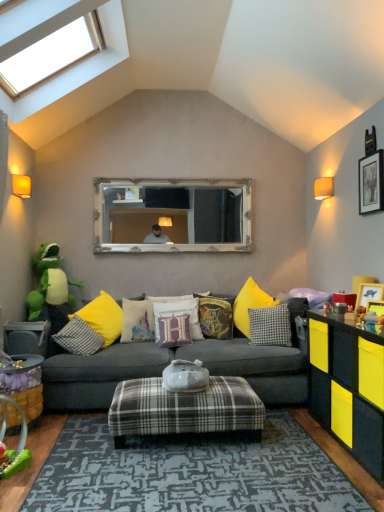
Question: Is velvet harry potter-themed pillow at center, acting as the sixth pillow starting from the left, touching wooden textured basket at lower left, the first table from the bottom?

Choices:
 (A) no
 (B) yes

Answer: (A)

Question: Can you confirm if velvet harry potter-themed pillow at center, which appears as the 2th pillow when viewed from the right, is thinner than wooden textured basket at lower left, marked as the 2th table in a top-to-bottom arrangement?

Choices:
 (A) yes
 (B) no

Answer: (A)

Question: Can you confirm if velvet harry potter-themed pillow at center, acting as the sixth pillow starting from the left, is shorter than wooden textured basket at lower left, marked as the 2th table in a top-to-bottom arrangement?

Choices:
 (A) yes
 (B) no

Answer: (A)

Question: Does velvet harry potter-themed pillow at center, acting as the sixth pillow starting from the left, have a larger size compared to wooden textured basket at lower left, the first table from the bottom?

Choices:
 (A) yes
 (B) no

Answer: (B)

Question: Is the depth of velvet harry potter-themed pillow at center, acting as the sixth pillow starting from the left, greater than that of wooden textured basket at lower left, marked as the 2th table in a top-to-bottom arrangement?

Choices:
 (A) no
 (B) yes

Answer: (B)

Question: Would you consider velvet harry potter-themed pillow at center, which appears as the 2th pillow when viewed from the right, to be distant from wooden textured basket at lower left, marked as the 2th table in a top-to-bottom arrangement?

Choices:
 (A) yes
 (B) no

Answer: (A)

Question: Can you confirm if checkered fabric pillow at center, the first pillow in the left-to-right sequence, is bigger than wooden framed picture at upper right, which is the 3th picture frame from front to back?

Choices:
 (A) no
 (B) yes

Answer: (B)

Question: Is checkered fabric pillow at center, the first pillow in the left-to-right sequence, far away from wooden framed picture at upper right, which is counted as the 1th picture frame, starting from the top?

Choices:
 (A) no
 (B) yes

Answer: (B)

Question: Is checkered fabric pillow at center, the first pillow in the left-to-right sequence, placed right next to wooden framed picture at upper right, which is the 3th picture frame from front to back?

Choices:
 (A) no
 (B) yes

Answer: (A)

Question: Is checkered fabric pillow at center, arranged as the 7th pillow when viewed from the right, thinner than wooden framed picture at upper right, the 1th picture frame from the back?

Choices:
 (A) no
 (B) yes

Answer: (A)

Question: Does checkered fabric pillow at center, the first pillow in the left-to-right sequence, have a greater height compared to wooden framed picture at upper right, placed as the third picture frame when sorted from bottom to top?

Choices:
 (A) no
 (B) yes

Answer: (A)

Question: Is checkered fabric pillow at center, the first pillow in the left-to-right sequence, closer to the viewer compared to wooden framed picture at upper right, placed as the third picture frame when sorted from bottom to top?

Choices:
 (A) yes
 (B) no

Answer: (B)

Question: Can you confirm if velvet purple pillow at center, positioned as the fourth pillow in left-to-right order, is taller than velvet harry potter cushion at center, which is the 3th pillow in right-to-left order?

Choices:
 (A) yes
 (B) no

Answer: (B)